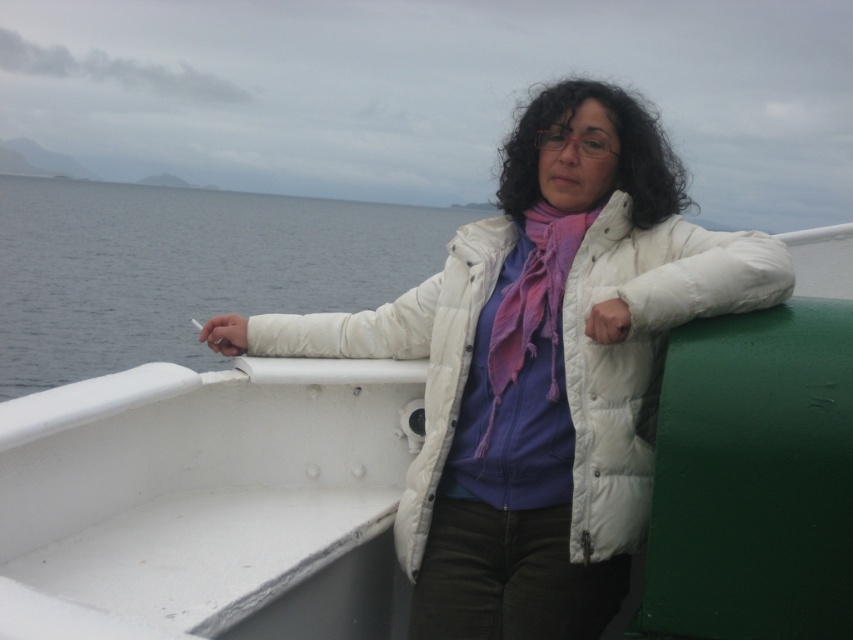
Looking at this image, which of these two, white puffy jacket at center or matte purple scarf at center, stands shorter?

With less height is matte purple scarf at center.

Is white puffy jacket at center shorter than matte purple scarf at center?

No.

I want to click on white puffy jacket at center, so click(641, 353).

At what (x,y) coordinates should I click in order to perform the action: click on white puffy jacket at center. Please return your answer as a coordinate pair (x, y). Image resolution: width=853 pixels, height=640 pixels. Looking at the image, I should click on (641, 353).

Does white puffy jacket at center appear on the right side of blue water at left?

Indeed, white puffy jacket at center is positioned on the right side of blue water at left.

What do you see at coordinates (641, 353) in the screenshot? I see `white puffy jacket at center` at bounding box center [641, 353].

Which is in front, point (412, 470) or point (132, 288)?

Positioned in front is point (412, 470).

Image resolution: width=853 pixels, height=640 pixels. What are the coordinates of `white puffy jacket at center` in the screenshot? It's located at (641, 353).

Is point (129, 221) farther from camera compared to point (524, 296)?

Yes, it is.

Is blue water at left to the right of matte purple scarf at center from the viewer's perspective?

In fact, blue water at left is to the left of matte purple scarf at center.

Which is behind, point (119, 333) or point (531, 268)?

The point (119, 333) is more distant.

At what (x,y) coordinates should I click in order to perform the action: click on blue water at left. Please return your answer as a coordinate pair (x, y). This screenshot has width=853, height=640. Looking at the image, I should click on (184, 268).